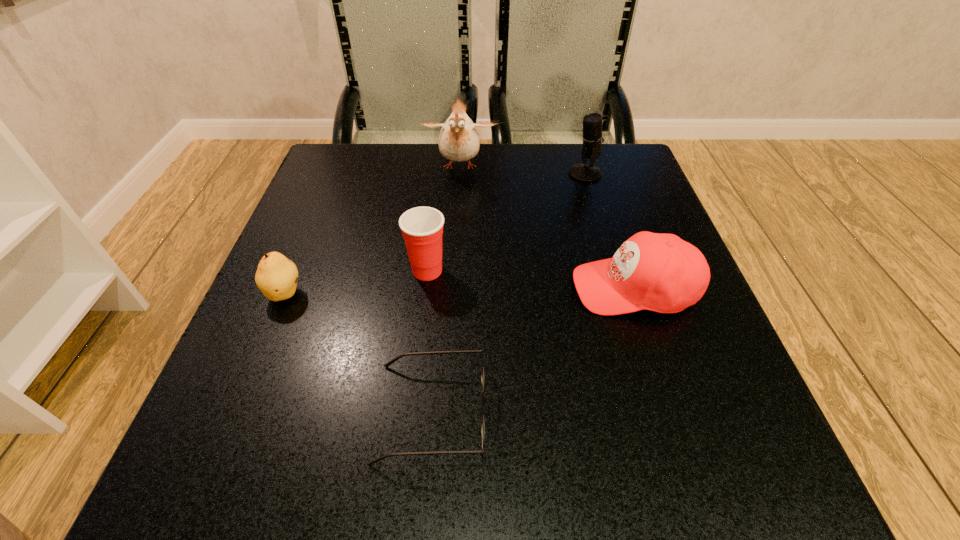
The width and height of the screenshot is (960, 540). In order to click on microphone that is at the right edge in this screenshot , I will do `click(592, 137)`.

In order to click on baseball cap at the right edge in this screenshot , I will do `click(658, 272)`.

Locate an element on the screen. object that is at the far right corner is located at coordinates (592, 137).

In the image, there is a desktop. Where is `vacant space at the far edge`? This screenshot has width=960, height=540. vacant space at the far edge is located at coordinates click(x=552, y=168).

Where is `free location at the near edge`? The image size is (960, 540). free location at the near edge is located at coordinates (356, 463).

Image resolution: width=960 pixels, height=540 pixels. Identify the location of blank space at the left edge. (363, 209).

In the image, there is a desktop. Where is `vacant space at the right edge`? The width and height of the screenshot is (960, 540). vacant space at the right edge is located at coordinates (583, 209).

I want to click on free region at the near left corner of the desktop, so click(284, 498).

The width and height of the screenshot is (960, 540). I want to click on free space between the bird and the pear, so click(x=372, y=231).

In order to click on vacant point located between the second shortest object and the Dixie cup in this screenshot , I will do `click(356, 282)`.